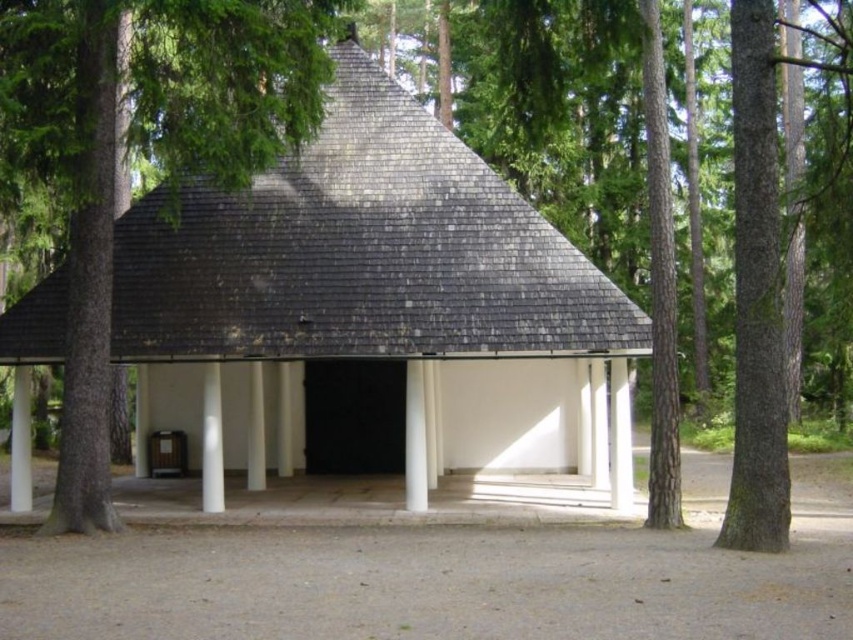
You are standing at point (x=260, y=348) and want to walk to the entrance of the rustic structure. The path is 14.78 meters long. If your walking speed is 1.2 meters per second, how long will it take you to reach the entrance?

The path between point (x=260, y=348) and the entrance is 14.78 meters. At a walking speed of 1.2 meters per second, it will take approximately 12.32 seconds to reach the entrance.

You are a hiker who wants to take a photo of the wooden shingles hut at center and the brown rough bark tree at right from a distance. Which one will appear larger in the photo?

The wooden shingles hut at center will appear larger in the photo because it is much taller than the brown rough bark tree at right.

You are standing at the point marked by the coordinates point (x=367, y=301) in the image. What object are you directly at?

The point (x=367, y=301) marks the wooden shingles hut at center, so you are directly at the wooden shingles hut at center.